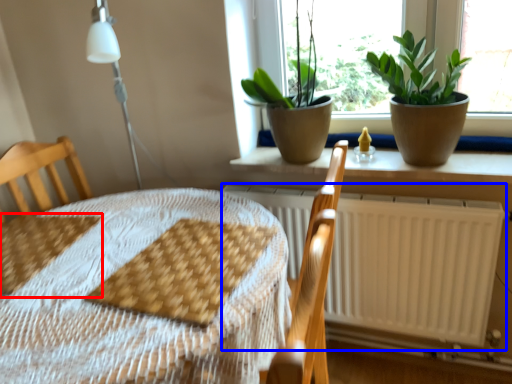
Question: Which point is further to the camera, sheet (highlighted by a red box) or radiator (highlighted by a blue box)?

Choices:
 (A) sheet
 (B) radiator

Answer: (B)